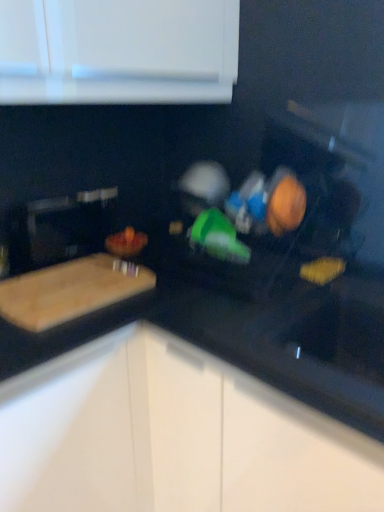
Question: From a real-world perspective, is orange matte bowl at center, marked as the third food in a right-to-left arrangement, under wooden bowl at center, the second food positioned from the right?

Choices:
 (A) yes
 (B) no

Answer: (A)

Question: From the image's perspective, is orange matte bowl at center, marked as the third food in a right-to-left arrangement, located above wooden bowl at center, placed as the 1th food when sorted from front to back?

Choices:
 (A) yes
 (B) no

Answer: (B)

Question: Does orange matte bowl at center, the first food when ordered from back to front, lie behind wooden bowl at center, acting as the 2th food starting from the left?

Choices:
 (A) no
 (B) yes

Answer: (B)

Question: Considering the relative sizes of orange matte bowl at center, positioned as the third food in front-to-back order, and wooden bowl at center, acting as the 2th food starting from the left, in the image provided, is orange matte bowl at center, positioned as the third food in front-to-back order, thinner than wooden bowl at center, acting as the 2th food starting from the left,?

Choices:
 (A) no
 (B) yes

Answer: (A)

Question: Does orange matte bowl at center, the first food when ordered from back to front, have a smaller size compared to wooden bowl at center, the third food in the back-to-front sequence?

Choices:
 (A) yes
 (B) no

Answer: (B)

Question: From the image's perspective, does orange matte bowl at center, which is the first food from left to right, appear lower than wooden bowl at center, the third food in the back-to-front sequence?

Choices:
 (A) yes
 (B) no

Answer: (A)

Question: Is the position of wooden bowl at center, the third food in the back-to-front sequence, less distant than that of orange matte bowl at center, which is the first food from left to right?

Choices:
 (A) no
 (B) yes

Answer: (B)

Question: Can you confirm if wooden bowl at center, acting as the 2th food starting from the left, is smaller than orange matte bowl at center, the first food when ordered from back to front?

Choices:
 (A) no
 (B) yes

Answer: (B)

Question: Is wooden bowl at center, placed as the 1th food when sorted from front to back, positioned with its back to orange matte bowl at center, the first food when ordered from back to front?

Choices:
 (A) no
 (B) yes

Answer: (A)

Question: From a real-world perspective, does wooden bowl at center, the third food in the back-to-front sequence, sit lower than orange matte bowl at center, marked as the third food in a right-to-left arrangement?

Choices:
 (A) yes
 (B) no

Answer: (B)

Question: Is wooden bowl at center, the second food positioned from the right, aimed at orange matte bowl at center, positioned as the third food in front-to-back order?

Choices:
 (A) yes
 (B) no

Answer: (B)

Question: From a real-world perspective, is wooden bowl at center, the third food in the back-to-front sequence, on orange matte bowl at center, the first food when ordered from back to front?

Choices:
 (A) yes
 (B) no

Answer: (A)

Question: Is natural wood cutting board at left positioned far away from black glossy countertop at center?

Choices:
 (A) yes
 (B) no

Answer: (B)